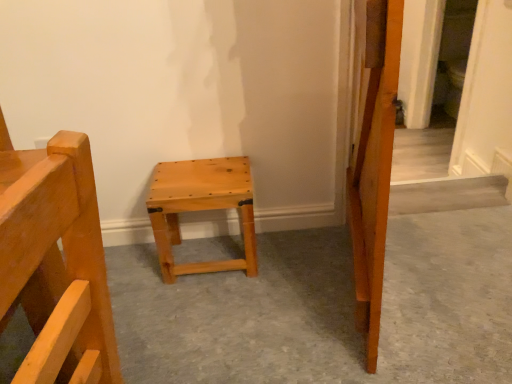
Where is `vacant region below natural wood stool at center (from a real-world perspective)`? The width and height of the screenshot is (512, 384). vacant region below natural wood stool at center (from a real-world perspective) is located at coordinates (209, 249).